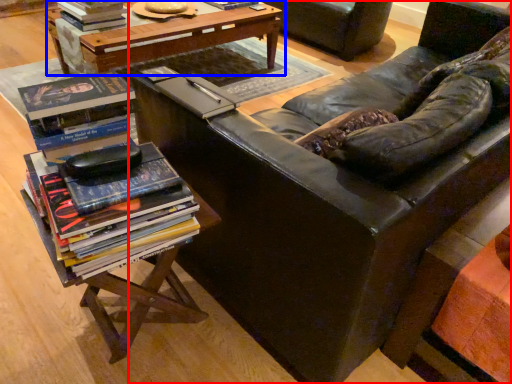
Question: Which of the following is the closest to the observer, studio couch (highlighted by a red box) or table (highlighted by a blue box)?

Choices:
 (A) studio couch
 (B) table

Answer: (A)